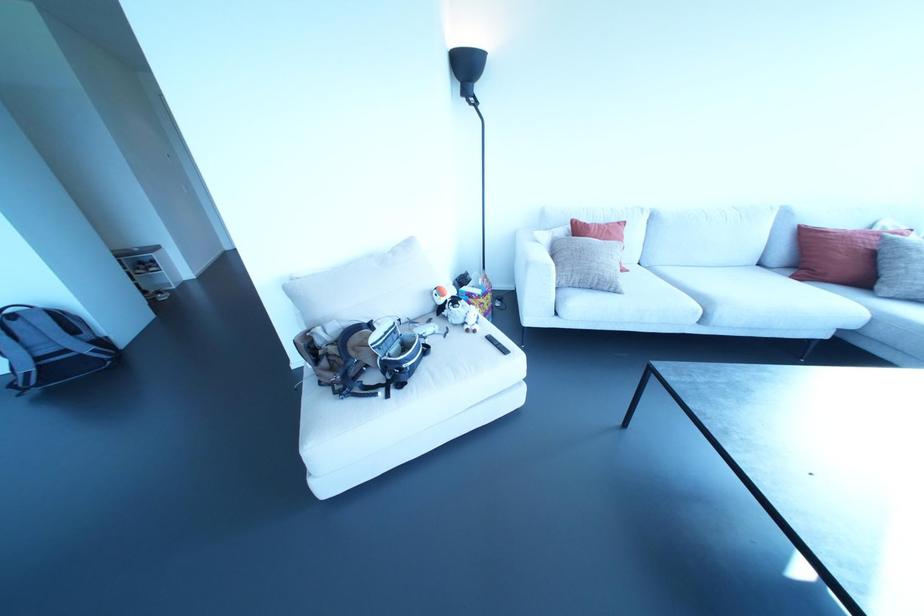
Describe the element at coordinates (728, 291) in the screenshot. I see `a sofa sitting surface` at that location.